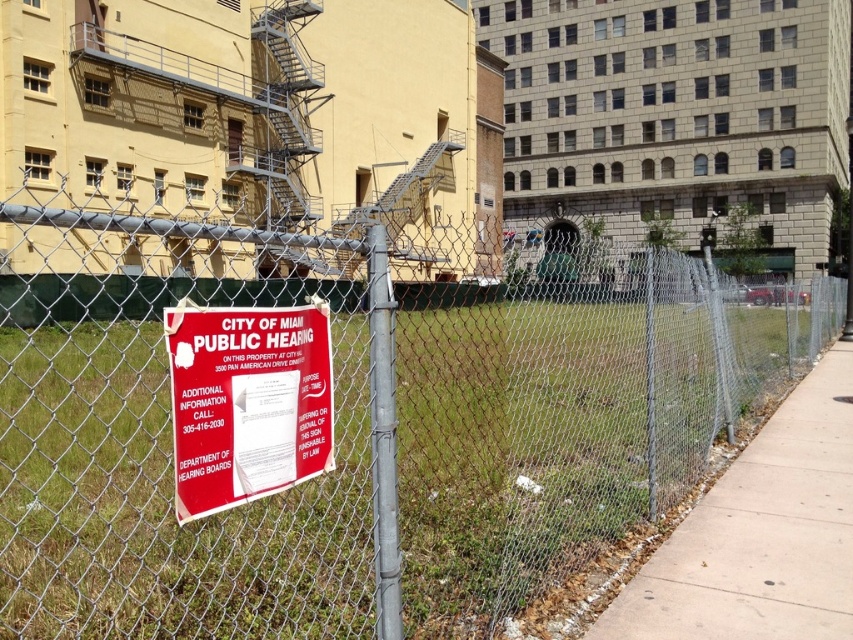
Is the position of rusty chain-link fence at center more distant than that of concrete sidewalk at lower right?

No, rusty chain-link fence at center is closer to the viewer.

At what (x,y) coordinates should I click in order to perform the action: click on rusty chain-link fence at center. Please return your answer as a coordinate pair (x, y). The height and width of the screenshot is (640, 853). Looking at the image, I should click on (369, 436).

You are a GUI agent. You are given a task and a screenshot of the screen. Output one action in this format:
    pyautogui.click(x=<x>, y=<y>)
    Task: Click on the rusty chain-link fence at center
    
    Given the screenshot: What is the action you would take?
    pyautogui.click(x=369, y=436)

Identify the location of rusty chain-link fence at center. The width and height of the screenshot is (853, 640). (369, 436).

Between concrete sidewalk at lower right and red paper sign at center, which one has more height?

With more height is red paper sign at center.

Can you confirm if concrete sidewalk at lower right is bigger than red paper sign at center?

Correct, concrete sidewalk at lower right is larger in size than red paper sign at center.

Find the location of `concrete sidewalk at lower right`. concrete sidewalk at lower right is located at coordinates (759, 532).

Looking at this image, which is above, rusty chain-link fence at center or red paper sign at center?

rusty chain-link fence at center is above.

Can you confirm if rusty chain-link fence at center is shorter than red paper sign at center?

No.

What do you see at coordinates (369, 436) in the screenshot? The height and width of the screenshot is (640, 853). I see `rusty chain-link fence at center` at bounding box center [369, 436].

Where is `rusty chain-link fence at center`? Image resolution: width=853 pixels, height=640 pixels. rusty chain-link fence at center is located at coordinates (369, 436).